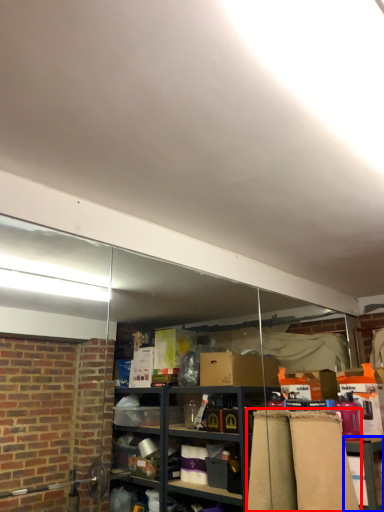
Question: Which object appears farthest to the camera in this image, curtain (highlighted by a red box) or table (highlighted by a blue box)?

Choices:
 (A) curtain
 (B) table

Answer: (B)